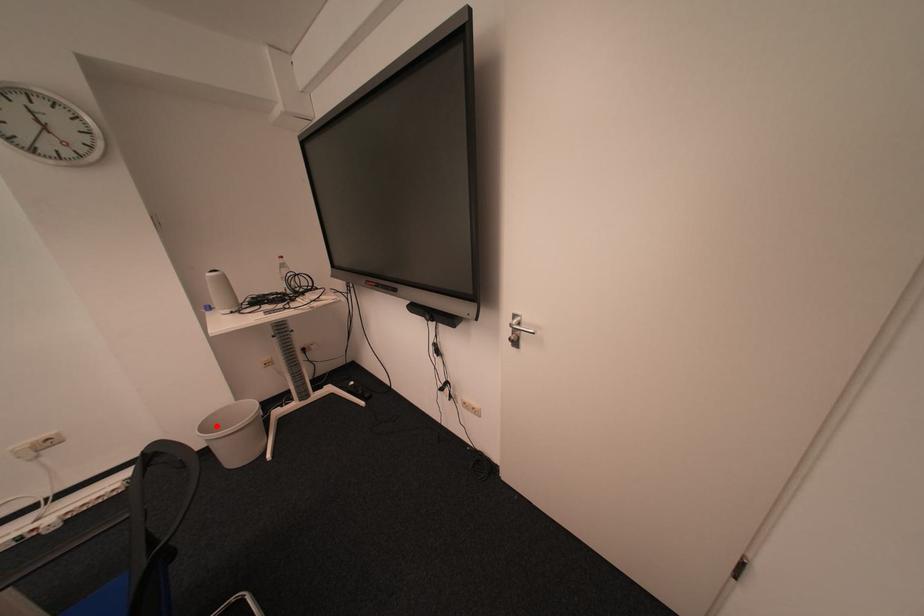
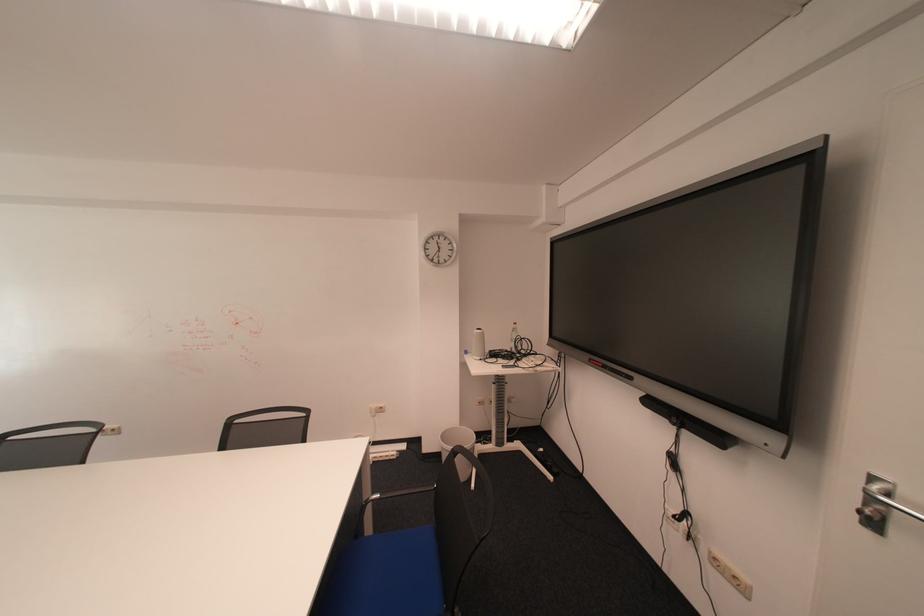
In the second image, find the point that corresponds to the highlighted location in the first image.

(456, 437)